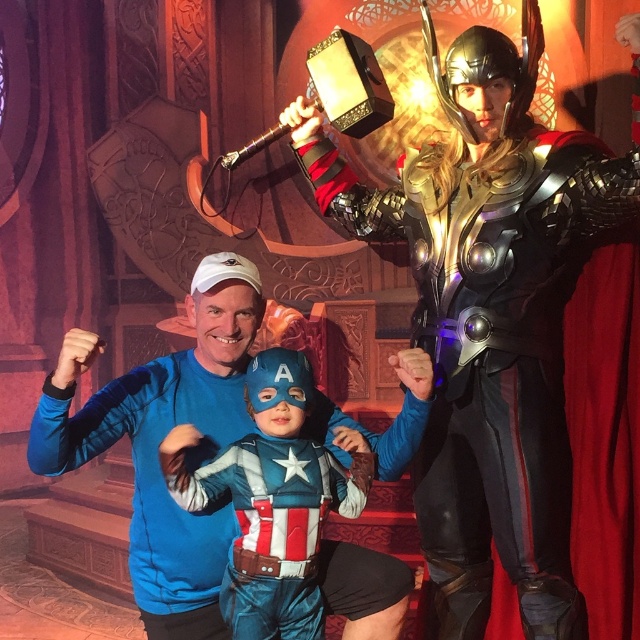
Between point (563, 628) and point (344, 595), which one is positioned in front?

Point (344, 595)

Can you confirm if shiny gold armor at center is taller than blue fabric shirt at center?

Yes.

Which is in front, point (467, 220) or point (262, 316)?

Point (262, 316)

I want to click on shiny gold armor at center, so click(x=490, y=312).

Image resolution: width=640 pixels, height=640 pixels. Describe the element at coordinates (161, 440) in the screenshot. I see `blue fabric shirt at center` at that location.

Who is more distant from viewer, (164, 541) or (186, 490)?

The point (164, 541) is more distant.

Identify the location of blue fabric shirt at center. This screenshot has height=640, width=640. (161, 440).

Which is behind, point (520, 516) or point (182, 436)?

The point (520, 516) is more distant.

Is shiny gold armor at center further to camera compared to velvet blue costume at center?

Yes, shiny gold armor at center is behind velvet blue costume at center.

Is point (624, 193) less distant than point (243, 492)?

No, it is behind (243, 492).

In order to click on shiny gold armor at center in this screenshot , I will do `click(490, 312)`.